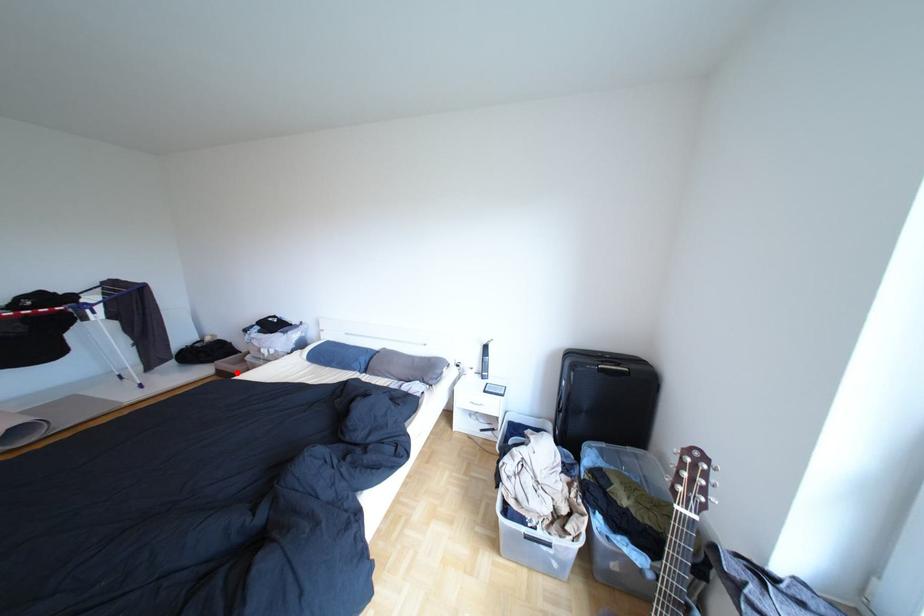
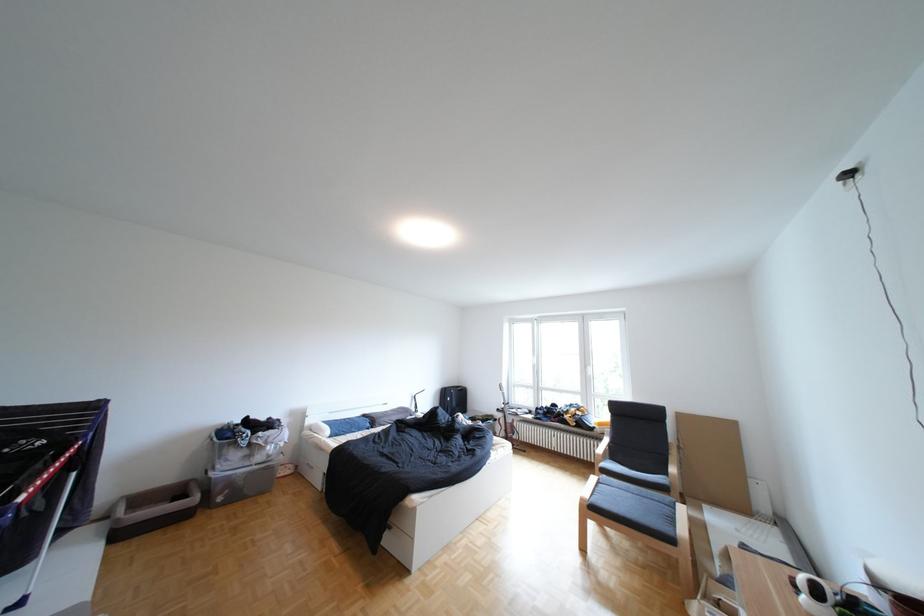
Question: A red point is marked in image1. In image2, is the corresponding 3D point closer to the camera or farther? Reply with the corresponding letter.

Choices:
 (A) The corresponding 3D point is closer.
 (B) The corresponding 3D point is farther.

Answer: (A)